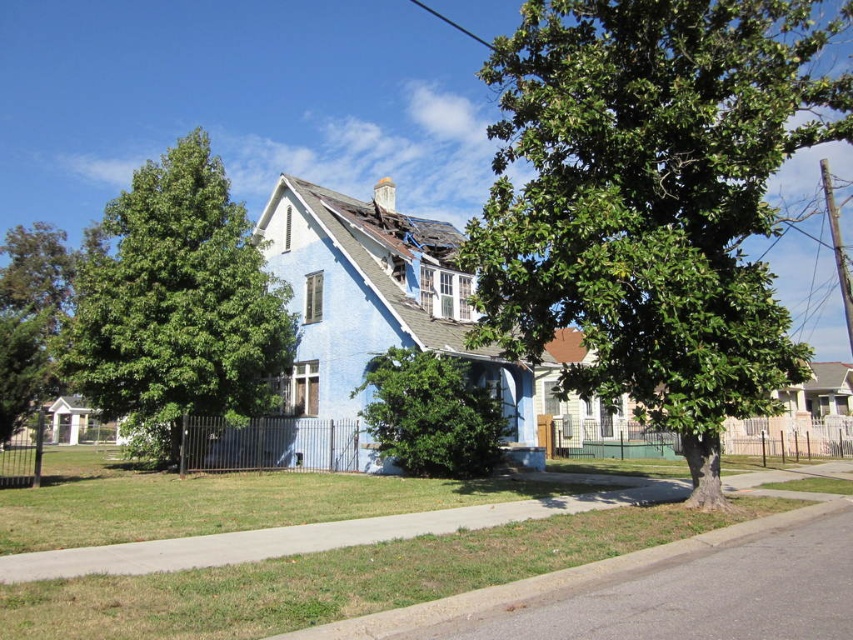
Based on the photo, is green leafy bush at center above green leafy tree at lower left?

Actually, green leafy bush at center is below green leafy tree at lower left.

Does green leafy bush at center lie behind green leafy tree at lower left?

Yes, it is behind green leafy tree at lower left.

Between point (422, 374) and point (39, 349), which one is positioned behind?

The point (422, 374) is more distant.

This screenshot has width=853, height=640. Identify the location of green leafy bush at center. (431, 413).

Is green leafy tree at left thinner than green leafy tree at lower left?

In fact, green leafy tree at left might be wider than green leafy tree at lower left.

Between point (190, 376) and point (39, 333), which one is positioned behind?

Point (39, 333)

Find the location of a particular element. This screenshot has width=853, height=640. green leafy tree at left is located at coordinates (177, 304).

Is green leafy tree at center wider than green leafy bush at center?

Yes, green leafy tree at center is wider than green leafy bush at center.

Is green leafy tree at center smaller than green leafy bush at center?

No, green leafy tree at center is not smaller than green leafy bush at center.

Describe the element at coordinates (651, 202) in the screenshot. I see `green leafy tree at center` at that location.

This screenshot has height=640, width=853. Identify the location of green leafy tree at center. (651, 202).